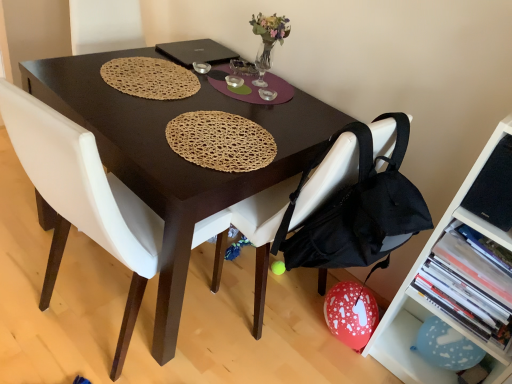
Where is `free spot behind metallic silver bowl at center`? free spot behind metallic silver bowl at center is located at coordinates coord(210,57).